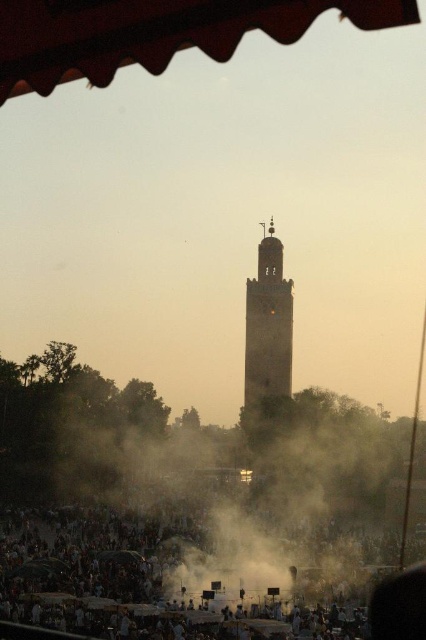
You are standing at the base of the minaret and want to walk towards the point marked at coordinates point (88, 8) and point (250, 384). Which point will you reach first?

You will reach point (88, 8) first because it is in front of point (250, 384), meaning it is closer to your starting position at the base of the minaret.

You are a photographer trying to capture the minaret in the background without any obstructions. You notice the dark brown fabric crowd at lower center and the wooden textured awning at upper center. Which of these two objects is taller and might block your view of the minaret?

The dark brown fabric crowd at lower center is taller than the wooden textured awning at upper center, so it might block your view of the minaret.

You are a photographer trying to capture a clear photo of the brown stone tower at center. However, there is a dark brown fabric crowd at lower center in the way. Based on their heights, can you adjust your camera angle to see the tower without the crowd blocking it?

The dark brown fabric crowd at lower center is not as tall as the brown stone tower at center, so yes, you can adjust your camera angle upwards to see the tower above the crowd.